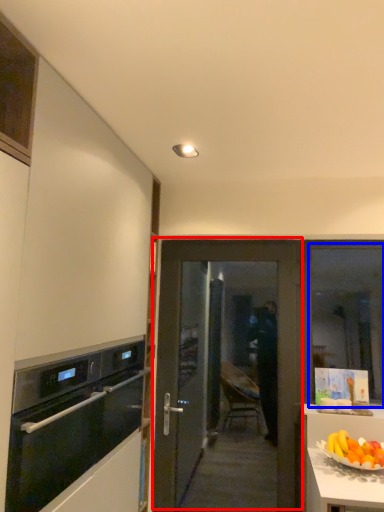
Question: Which point is further to the camera, door (highlighted by a red box) or window (highlighted by a blue box)?

Choices:
 (A) door
 (B) window

Answer: (B)